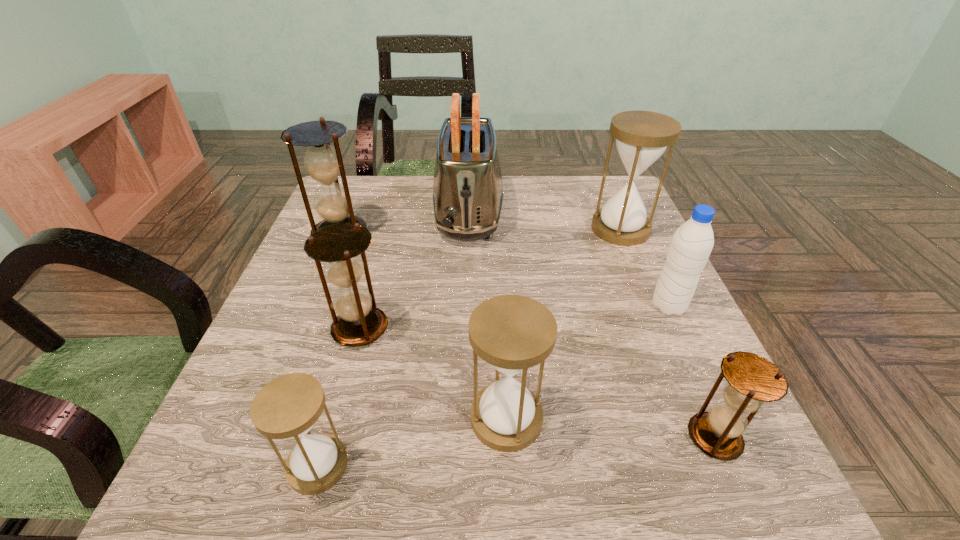
The width and height of the screenshot is (960, 540). I want to click on the smallest brown hourglass, so click(752, 380).

Find the location of a particular element. The image size is (960, 540). the leftmost white hourglass is located at coordinates (287, 407).

Where is `vacant point located 0.140m on the side of the toaster with the control lever`? The height and width of the screenshot is (540, 960). vacant point located 0.140m on the side of the toaster with the control lever is located at coordinates (466, 292).

Find the location of a particular element. The image size is (960, 540). vacant space located 0.310m on the front of the farthest white hourglass is located at coordinates [x=670, y=348].

I want to click on free space located on the back of the biggest brown hourglass, so click(360, 186).

Locate an element on the screen. The height and width of the screenshot is (540, 960). free space located 0.170m on the front of the gray water bottle is located at coordinates (708, 393).

I want to click on free space located 0.090m on the right of the third farthest hourglass, so click(x=435, y=329).

The width and height of the screenshot is (960, 540). In order to click on vacant area situated 0.330m on the back of the second biggest white hourglass in this screenshot , I will do `click(498, 265)`.

What are the coordinates of `vacant space located on the back of the rightmost brown hourglass` in the screenshot? It's located at (659, 308).

Where is `vacant space located 0.330m on the back of the leftmost white hourglass`? vacant space located 0.330m on the back of the leftmost white hourglass is located at coordinates (367, 292).